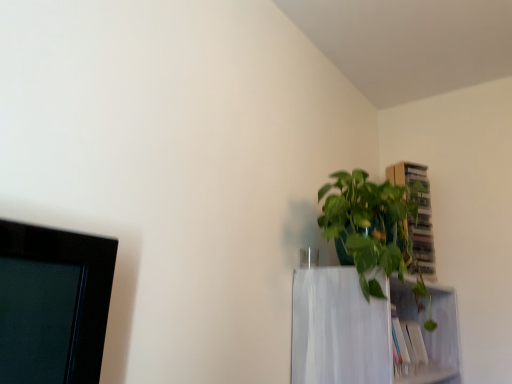
Question: Is wooden cabinet at upper right inside or outside of green glossy plant at upper right?

Choices:
 (A) outside
 (B) inside

Answer: (A)

Question: In terms of width, does wooden cabinet at upper right look wider or thinner when compared to green glossy plant at upper right?

Choices:
 (A) wide
 (B) thin

Answer: (B)

Question: Which of these objects is positioned farthest from the white matte shelf at upper right?

Choices:
 (A) wooden cabinet at upper right
 (B) green glossy plant at upper right

Answer: (A)

Question: Which object is the farthest from the wooden cabinet at upper right?

Choices:
 (A) white matte shelf at upper right
 (B) green glossy plant at upper right

Answer: (A)